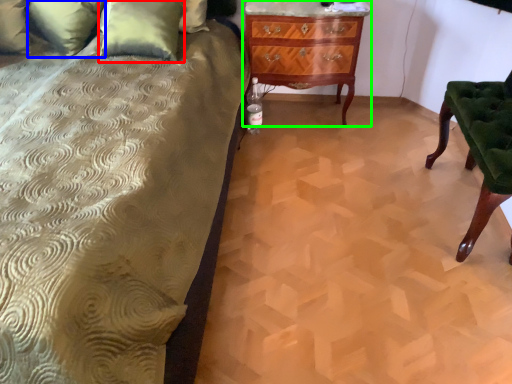
Question: Considering the real-world distances, which object is closest to pillow (highlighted by a red box)? pillow (highlighted by a blue box) or chest of drawers (highlighted by a green box).

Choices:
 (A) pillow
 (B) chest of drawers

Answer: (A)